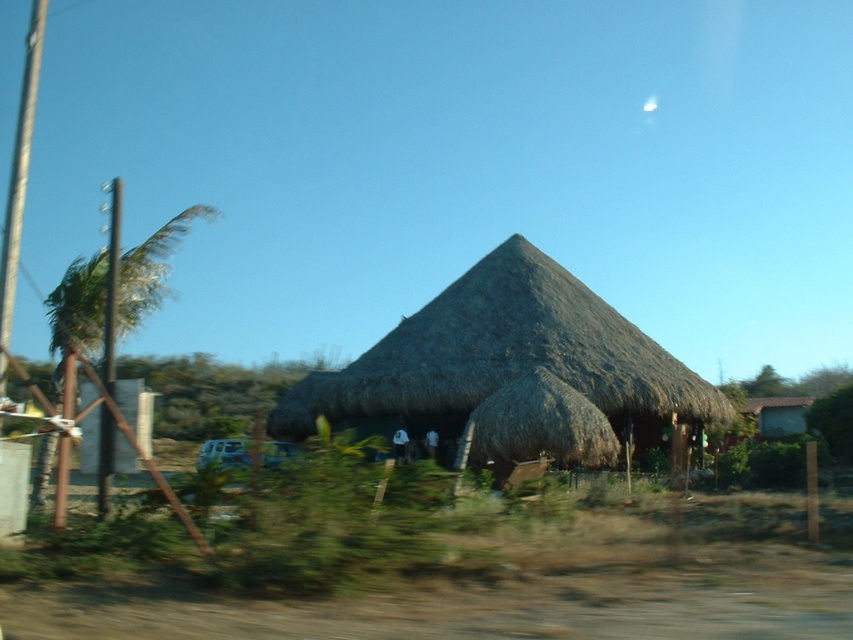
You are a pedestrian standing at the transparent glass car window at center. You want to walk to the white matte car at lower left. Which direction should you go?

You should walk to the left because the white matte car at lower left is located to the right of the transparent glass car window at center, so moving left from the window will lead you towards the car.